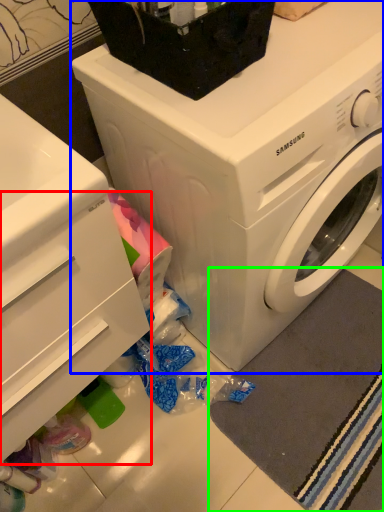
Question: Estimate the real-world distances between objects in this image. Which object is farther from drawer (highlighted by a red box), washing machine (highlighted by a blue box) or bath mat (highlighted by a green box)?

Choices:
 (A) washing machine
 (B) bath mat

Answer: (B)